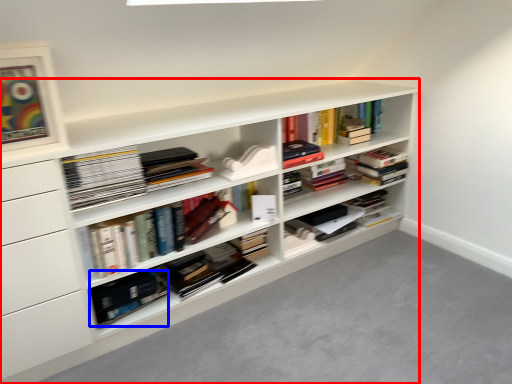
Question: Which point is closer to the camera, shelf (highlighted by a red box) or paperback book (highlighted by a blue box)?

Choices:
 (A) shelf
 (B) paperback book

Answer: (A)